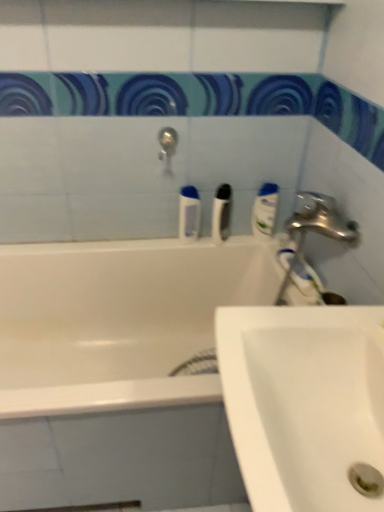
Question: Does white glossy bathtub at upper center have a greater height compared to white ceramic sink at lower right?

Choices:
 (A) no
 (B) yes

Answer: (B)

Question: Is white glossy bathtub at upper center surrounding white ceramic sink at lower right?

Choices:
 (A) no
 (B) yes

Answer: (A)

Question: Does white glossy bathtub at upper center have a greater width compared to white ceramic sink at lower right?

Choices:
 (A) yes
 (B) no

Answer: (A)

Question: Is white glossy bathtub at upper center smaller than white ceramic sink at lower right?

Choices:
 (A) no
 (B) yes

Answer: (A)

Question: Is there a large distance between white glossy bathtub at upper center and white ceramic sink at lower right?

Choices:
 (A) no
 (B) yes

Answer: (A)

Question: Is white ceramic sink at lower right to the left or to the right of white glossy bathtub at upper center in the image?

Choices:
 (A) right
 (B) left

Answer: (A)

Question: Considering their positions, is white ceramic sink at lower right located in front of or behind white glossy bathtub at upper center?

Choices:
 (A) front
 (B) behind

Answer: (A)

Question: Is point (297, 399) positioned closer to the camera than point (258, 304)?

Choices:
 (A) farther
 (B) closer

Answer: (B)

Question: From a real-world perspective, is white ceramic sink at lower right above or below white glossy bathtub at upper center?

Choices:
 (A) above
 (B) below

Answer: (A)

Question: From a real-world perspective, relative to white glossy mouthwash at upper right, which ranks as the first mouthwash in right-to-left order, is white glossy bathtub at upper center vertically above or below?

Choices:
 (A) below
 (B) above

Answer: (A)

Question: Considering their positions, is white glossy bathtub at upper center located in front of or behind white glossy mouthwash at upper right, acting as the second mouthwash starting from the left?

Choices:
 (A) behind
 (B) front

Answer: (B)

Question: Considering the relative positions of white glossy bathtub at upper center and white glossy mouthwash at upper right, which ranks as the first mouthwash in right-to-left order, in the image provided, is white glossy bathtub at upper center to the left or to the right of white glossy mouthwash at upper right, which ranks as the first mouthwash in right-to-left order,?

Choices:
 (A) left
 (B) right

Answer: (A)

Question: Considering the positions of white glossy bathtub at upper center and white glossy mouthwash at upper right, acting as the second mouthwash starting from the left, in the image, is white glossy bathtub at upper center bigger or smaller than white glossy mouthwash at upper right, acting as the second mouthwash starting from the left,?

Choices:
 (A) small
 (B) big

Answer: (B)

Question: Looking at their shapes, would you say white ceramic sink at lower right is wider or thinner than white glossy mouthwash at upper right, acting as the second mouthwash starting from the left?

Choices:
 (A) thin
 (B) wide

Answer: (B)

Question: Considering the positions of white ceramic sink at lower right and white glossy mouthwash at upper right, which ranks as the first mouthwash in right-to-left order, in the image, is white ceramic sink at lower right bigger or smaller than white glossy mouthwash at upper right, which ranks as the first mouthwash in right-to-left order,?

Choices:
 (A) big
 (B) small

Answer: (A)